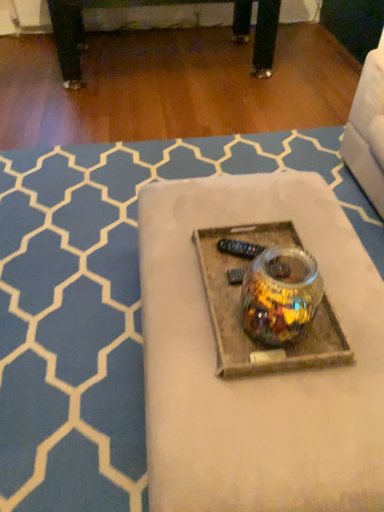
This screenshot has height=512, width=384. I want to click on blank space to the left of translucent glass jar at center, so click(x=216, y=315).